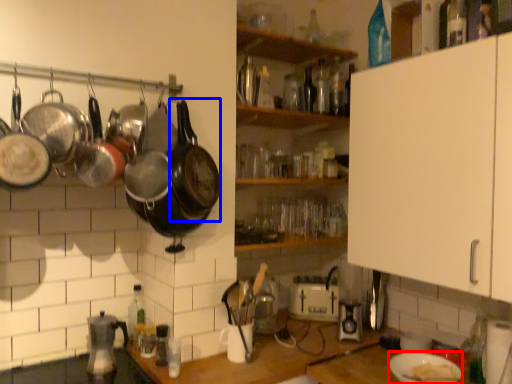
Question: Which object appears farthest to the camera in this image, appliance (highlighted by a red box) or wok (highlighted by a blue box)?

Choices:
 (A) appliance
 (B) wok

Answer: (B)